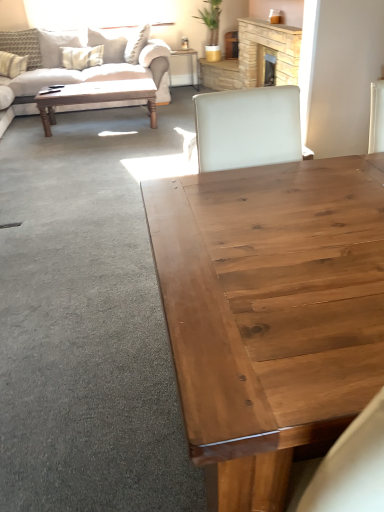
Find the location of a particular element. This screenshot has width=384, height=512. free point above natural wood coffee table at center, arranged as the second coffee table when viewed from the top (from a real-world perspective) is located at coordinates (303, 244).